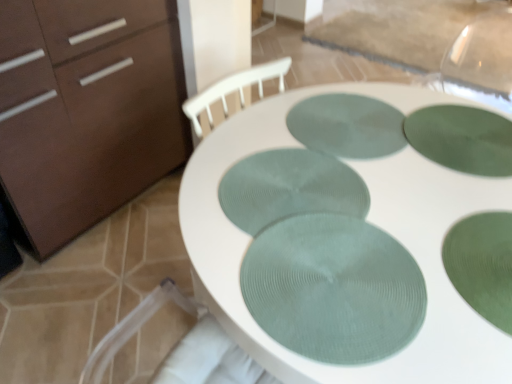
You are a GUI agent. You are given a task and a screenshot of the screen. Output one action in this format:
    pyautogui.click(x=<x>, y=<y>)
    Task: Click on the blank space situated above green textured placemat at center, which is the fifth glass plate in front-to-back order (from a real-world perspective)
    The image size is (512, 384).
    Given the screenshot: What is the action you would take?
    pyautogui.click(x=346, y=122)